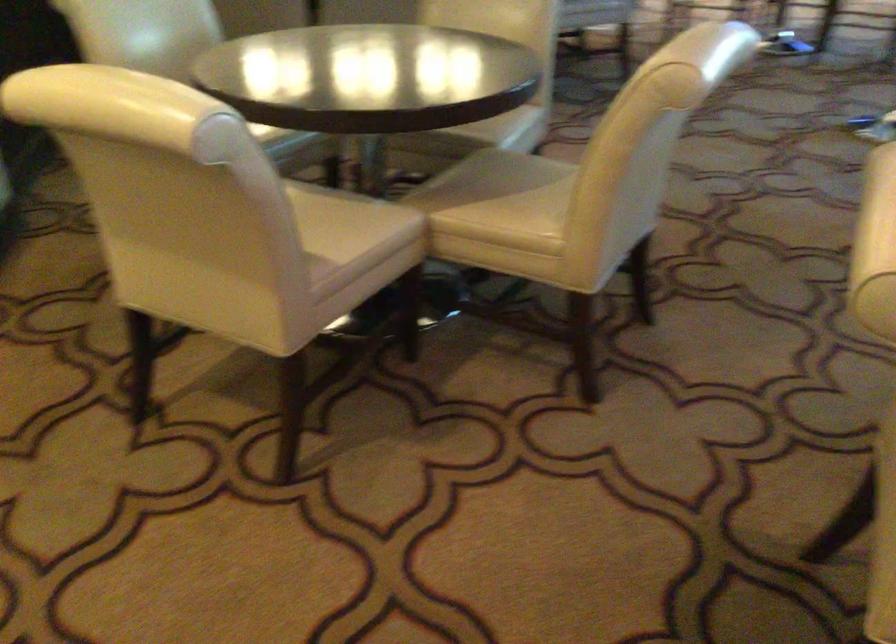
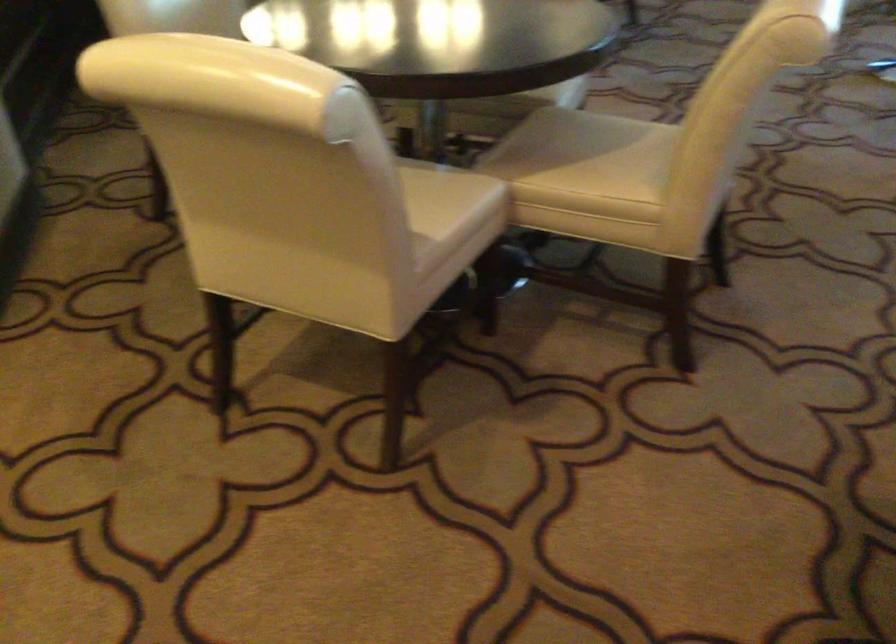
Question: The images are taken continuously from a first-person perspective. In which direction is your viewpoint rotating?

Choices:
 (A) Left
 (B) Right
 (C) Up
 (D) Down

Answer: (D)